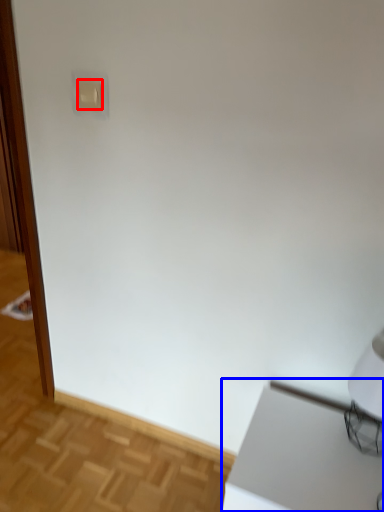
Question: Which object is further to the camera taking this photo, light switch (highlighted by a red box) or table (highlighted by a blue box)?

Choices:
 (A) light switch
 (B) table

Answer: (A)